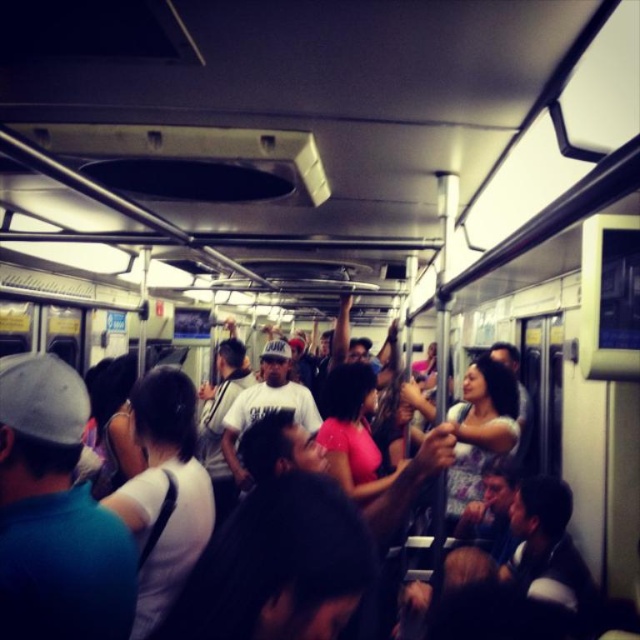
You are a passenger on a crowded subway train and you see the matte gray cap at left and the white matte shirt at center. Which object is closer to you?

The matte gray cap at left is closer to you because it is in front of the white matte shirt at center.

You are a passenger on a crowded subway train and you see a matte gray cap at left and a white matte shirt at center. Which object is positioned more to the right?

The matte gray cap at left is positioned more to the right than the white matte shirt at center.

You are a passenger on a crowded subway train and notice two items in your line of sight. You see the matte gray cap at left and the white matte shirt at center. Which item is positioned higher relative to the other?

The matte gray cap at left is above the white matte shirt at center, so the matte gray cap at left is positioned higher.